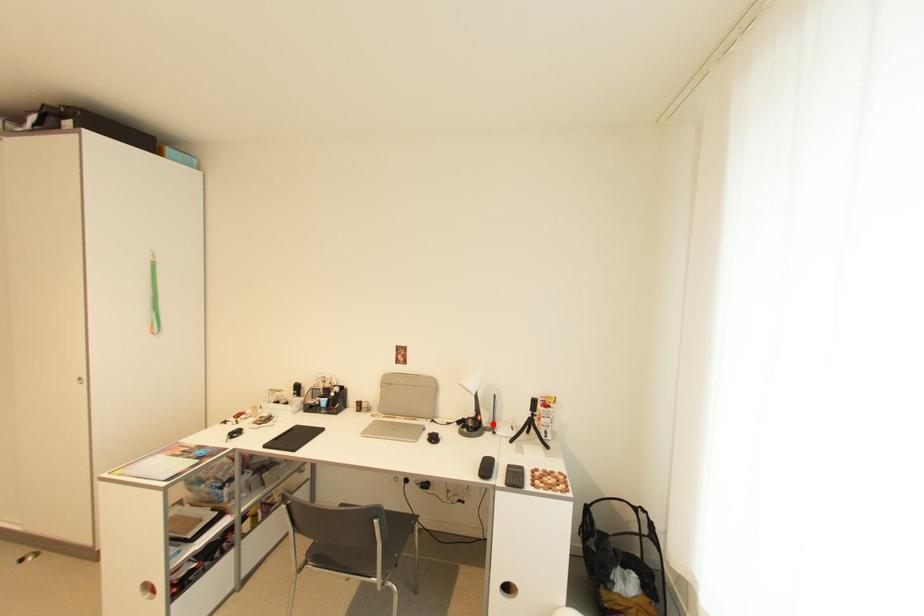
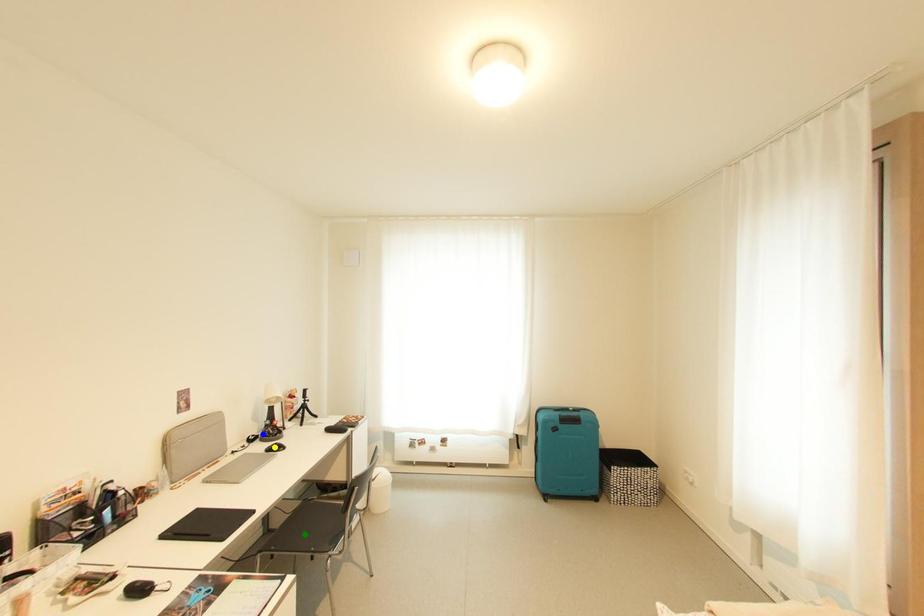
Question: I am providing you with two images of the same scene from different viewpoints. A red point is marked on the first image. You are given multiple points on the second image. Which spot in image 2 lines up with the point in image 1?

Choices:
 (A) green point
 (B) yellow point
 (C) blue point

Answer: (C)